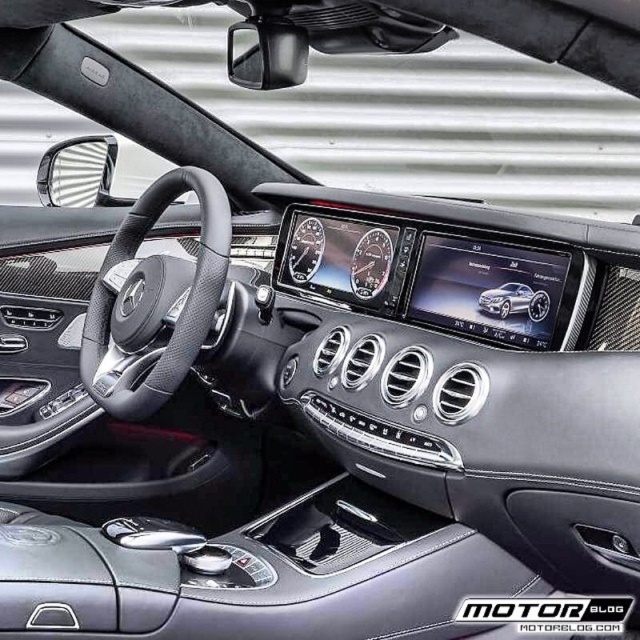
Question: Which point is farther from the camera taking this photo?

Choices:
 (A) (540, 310)
 (B) (120, 298)

Answer: (B)

Question: Is black leather steering wheel at center above satin silver metallic car at center?

Choices:
 (A) no
 (B) yes

Answer: (B)

Question: From the image, what is the correct spatial relationship of black leather steering wheel at center in relation to satin silver metallic car at center?

Choices:
 (A) left
 (B) right

Answer: (A)

Question: Is black leather steering wheel at center positioned before satin silver metallic car at center?

Choices:
 (A) no
 (B) yes

Answer: (A)

Question: Which of the following is the closest to the observer?

Choices:
 (A) (172, 182)
 (B) (490, 308)

Answer: (B)